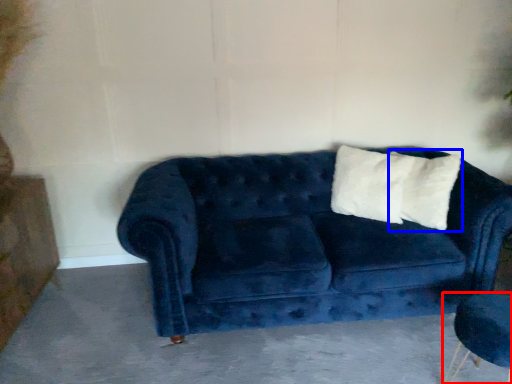
Question: Which of the following is the farthest to the observer, armchair (highlighted by a red box) or pillow (highlighted by a blue box)?

Choices:
 (A) armchair
 (B) pillow

Answer: (B)